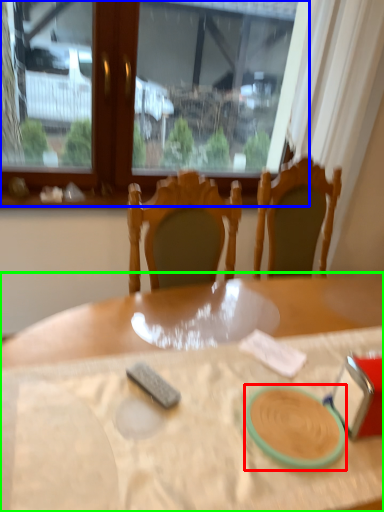
Question: Estimate the real-world distances between objects in this image. Which object is closer to tableware (highlighted by a red box), window (highlighted by a blue box) or table (highlighted by a green box)?

Choices:
 (A) window
 (B) table

Answer: (B)